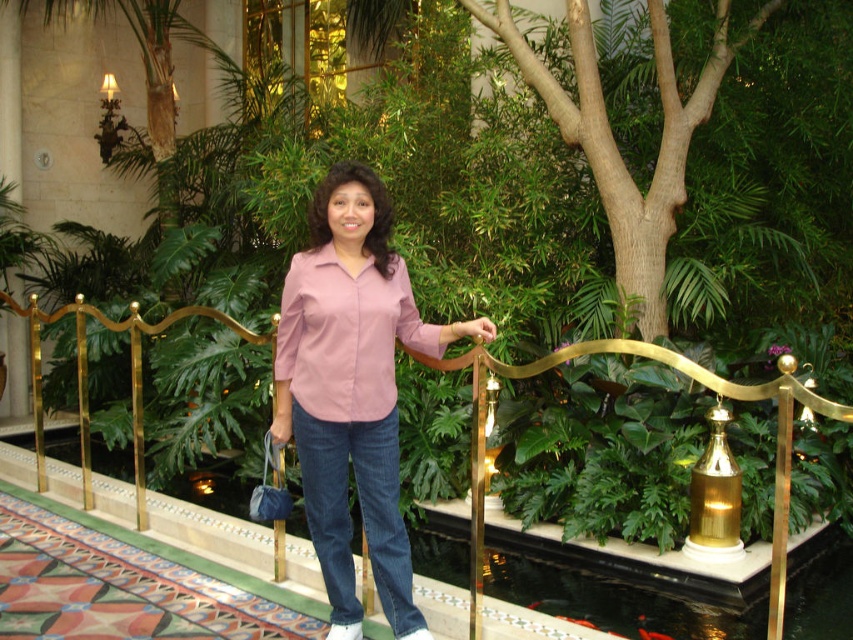
Is pink satin blouse at center further to camera compared to gold metallic rail at center?

That is True.

Is point (358, 349) more distant than point (714, 384)?

That is True.

Is point (390, 557) positioned before point (83, 369)?

Yes.

This screenshot has width=853, height=640. What are the coordinates of `pink satin blouse at center` in the screenshot? It's located at (352, 388).